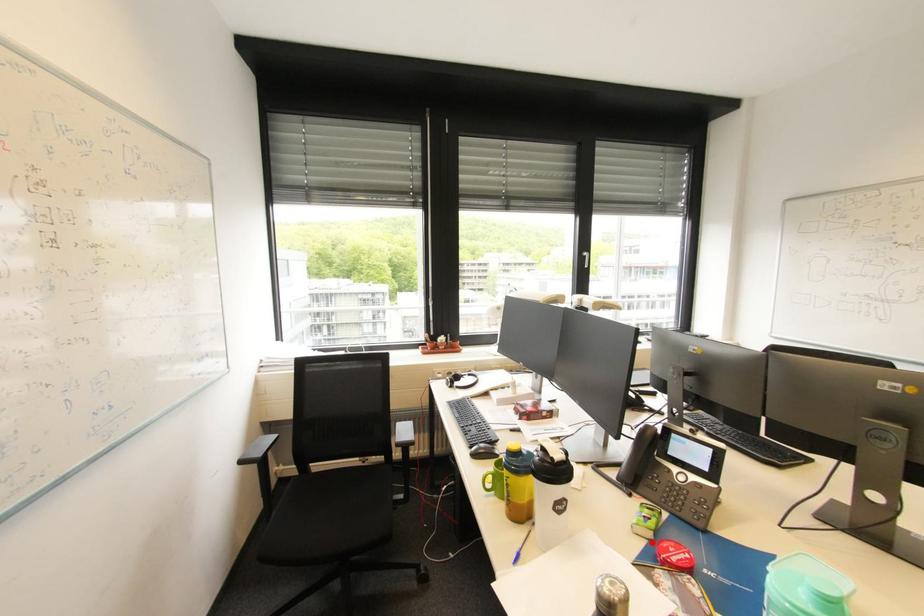
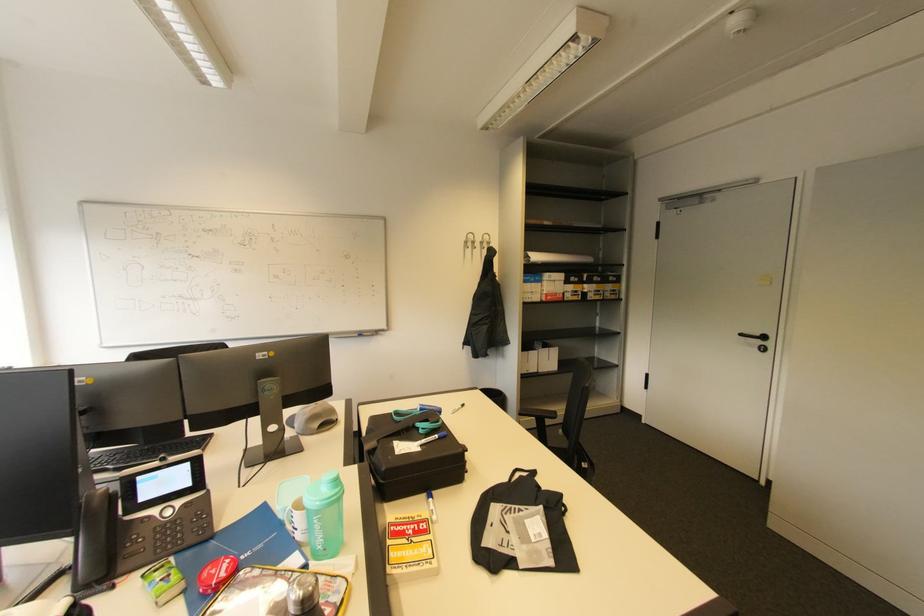
Where in the second image is the point corresponding to the highlighted location from the first image?

(187, 597)